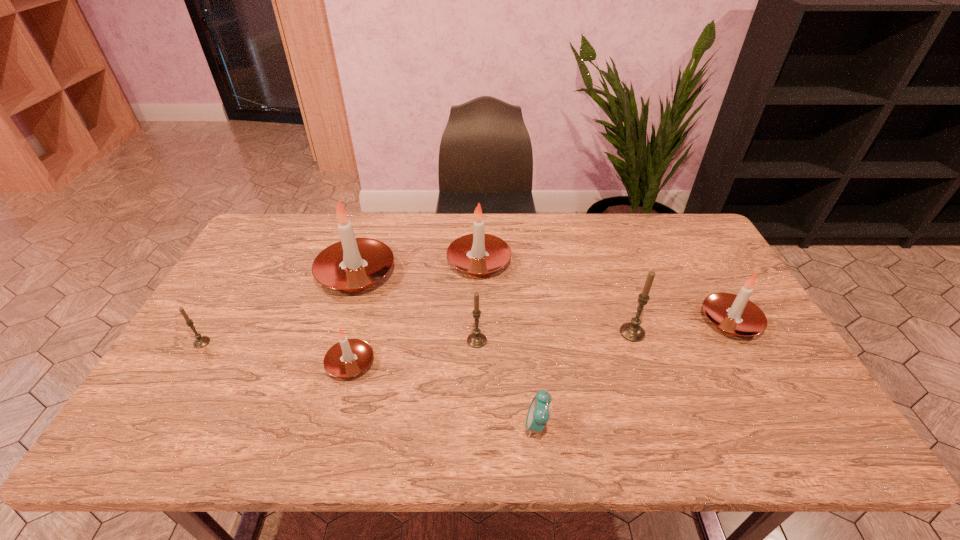
Identify which object is the third closest to the leftmost candle. Please provide its 2D coordinates. Your answer should be formatted as a tuple, i.e. [(x, y)], where the tuple contains the x and y coordinates of a point satisfying the conditions above.

[(478, 254)]

Where is `object that is the closest one to the second candle from right to left`? The height and width of the screenshot is (540, 960). object that is the closest one to the second candle from right to left is located at coordinates (736, 315).

I want to click on candle that is the second closest one to the third biggest white candle, so click(478, 254).

Where is `the third closest candle relative to the third white candle from left to right`? The width and height of the screenshot is (960, 540). the third closest candle relative to the third white candle from left to right is located at coordinates (349, 357).

Locate which white candle is the third closest to the smallest white candle. Please provide its 2D coordinates. Your answer should be formatted as a tuple, i.e. [(x, y)], where the tuple contains the x and y coordinates of a point satisfying the conditions above.

[(736, 315)]

Locate which white candle is the second closest to the smallest white candle. Please provide its 2D coordinates. Your answer should be formatted as a tuple, i.e. [(x, y)], where the tuple contains the x and y coordinates of a point satisfying the conditions above.

[(478, 254)]

This screenshot has width=960, height=540. Find the location of `gray candle that stands as the second closest to the second object from right to left`. gray candle that stands as the second closest to the second object from right to left is located at coordinates (200, 342).

Locate an element on the screen. This screenshot has width=960, height=540. gray candle that stands as the closest to the rightmost white candle is located at coordinates (633, 332).

Find the location of a particular element. free space in the image that satisfies the following two spatial constraints: 1. on the front side of the second gray candle from right to left; 2. on the left side of the biggest white candle is located at coordinates (335, 341).

Locate an element on the screen. free point that satisfies the following two spatial constraints: 1. on the back side of the rightmost gray candle; 2. on the right side of the second biggest gray candle is located at coordinates (477, 333).